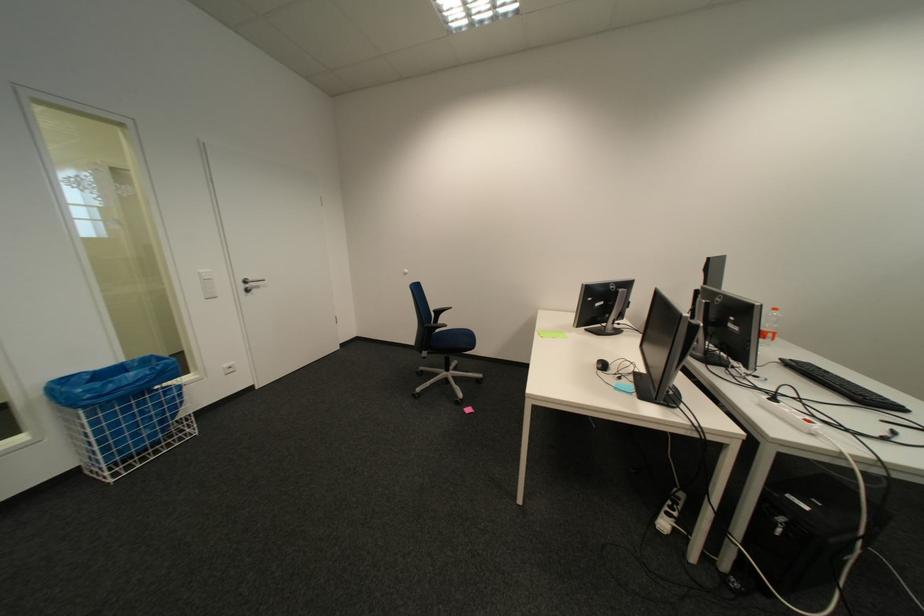
This screenshot has height=616, width=924. What are the coordinates of `black chair armrest` in the screenshot? It's located at click(434, 326).